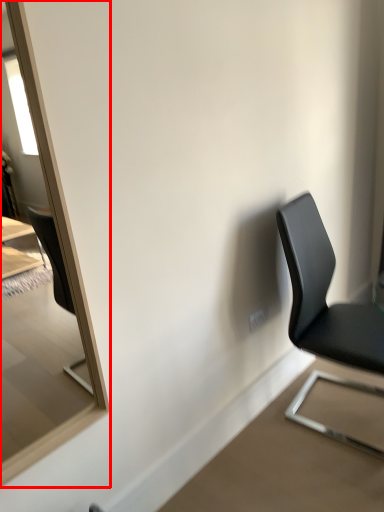
Question: Considering the relative positions of mirror (annotated by the red box) and chair in the image provided, where is mirror (annotated by the red box) located with respect to the staircase?

Choices:
 (A) right
 (B) left

Answer: (B)